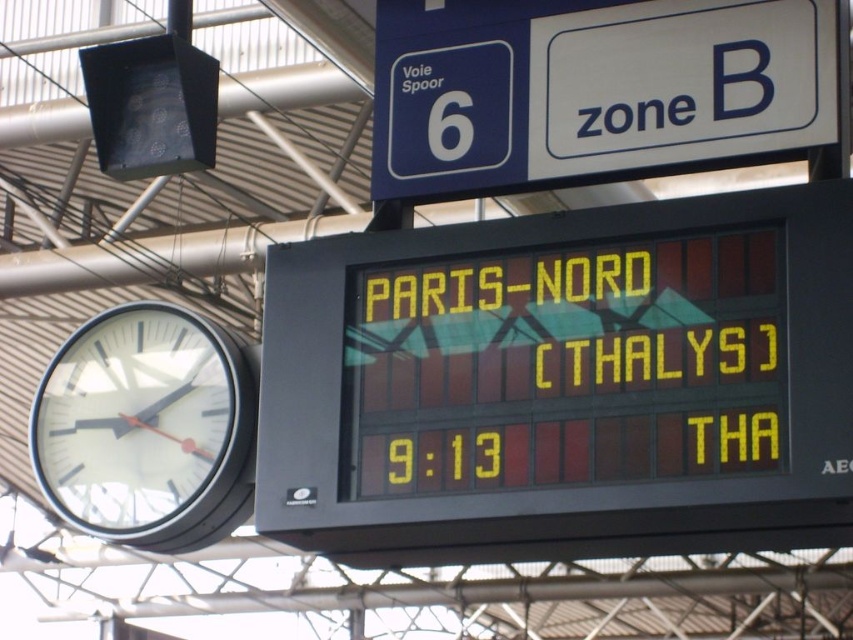
You are waiting at the train station and need to check the time and the departure board. You see the yellow led display at center and the white glossy clock at left. Which one is located to the right side?

The yellow led display at center is located to the right of the white glossy clock at left.

You are a maintenance worker needing to reach both the blue plastic sign at upper center and the white glossy clock at left with a ladder that can extend up to 7 meters. Can you safely reach both objects with this ladder?

The blue plastic sign at upper center and white glossy clock at left are 7.45 meters apart, so the ladder can only extend up to 7 meters. Therefore, the ladder is too short to safely reach both objects as the distance between them exceeds its maximum extension capability.